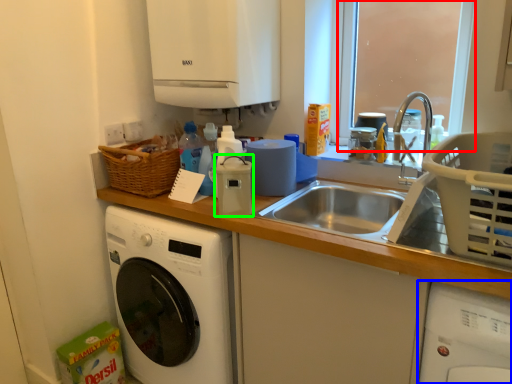
Question: Which is farther away from window screen (highlighted by a red box)? washing machine (highlighted by a blue box) or appliance (highlighted by a green box)?

Choices:
 (A) washing machine
 (B) appliance

Answer: (B)